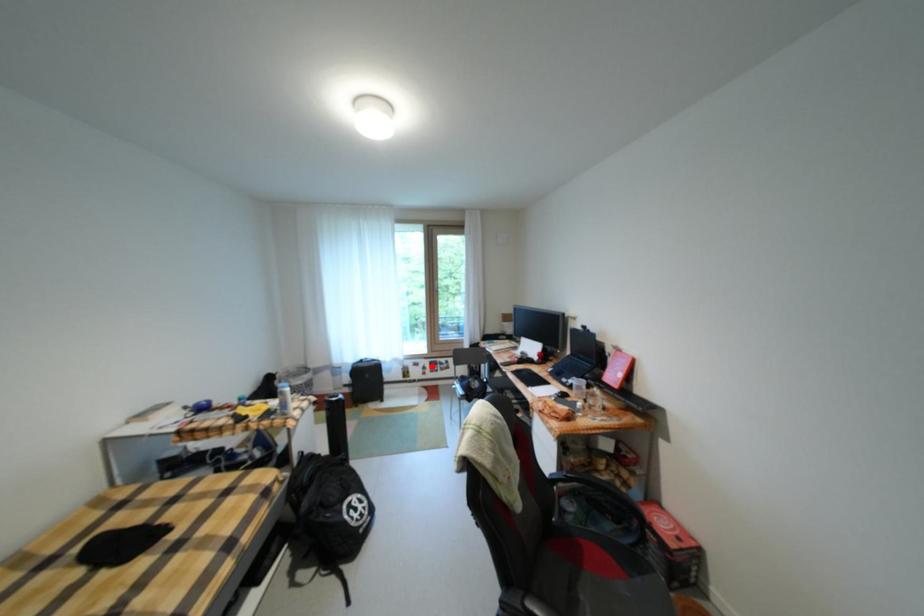
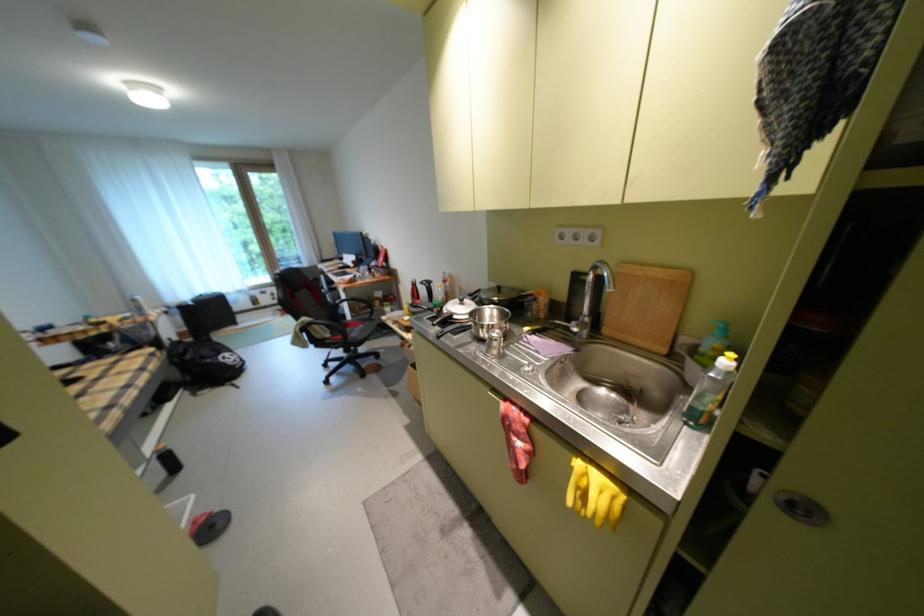
Question: I am providing you with two images of the same scene from different viewpoints. Given a red point in image1, look at the same physical point in image2. Is it:

Choices:
 (A) Closer to the viewpoint
 (B) Farther from the viewpoint

Answer: (B)